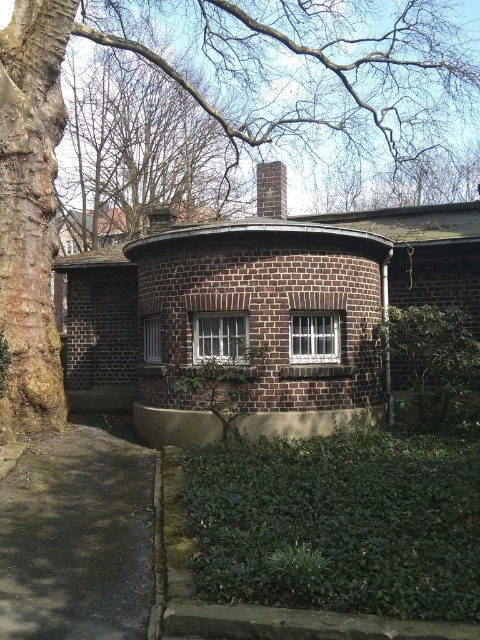
Question: Which object is closer to the camera taking this photo?

Choices:
 (A) brick chimney at upper center
 (B) green leafy hedge at center
 (C) green leafy hedge at lower center
 (D) green leafy hedge at lower right

Answer: (C)

Question: Is the position of brown rough bark tree at left less distant than that of green leafy hedge at lower center?

Choices:
 (A) yes
 (B) no

Answer: (B)

Question: Among these points, which one is farthest from the camera?

Choices:
 (A) (295, 484)
 (B) (225, 419)

Answer: (B)

Question: Is green leafy hedge at lower right smaller than green leafy hedge at center?

Choices:
 (A) yes
 (B) no

Answer: (B)

Question: Which object is closer to the camera taking this photo?

Choices:
 (A) brick chimney at upper center
 (B) brown rough bark tree at left

Answer: (B)

Question: Is brown rough bark tree at left to the right of green leafy hedge at lower center from the viewer's perspective?

Choices:
 (A) yes
 (B) no

Answer: (B)